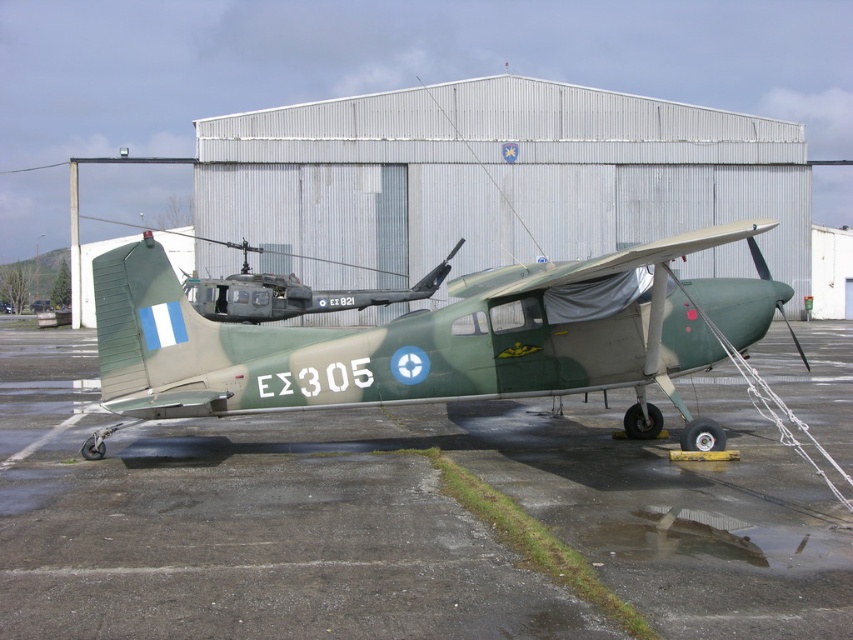
You are a maintenance worker needing to inspect the camouflage paint airplane at center. You are currently standing on the smooth asphalt tarmac at center. Which direction should you move to reach the airplane?

The camouflage paint airplane at center is above the smooth asphalt tarmac at center, so you should move upward to reach it.

You are a drone operator trying to land a drone on the smooth asphalt tarmac at center. What is the coordinate where you should aim to land the drone?

The smooth asphalt tarmac at center is located at point (393, 518), so you should aim for those coordinates to land the drone.